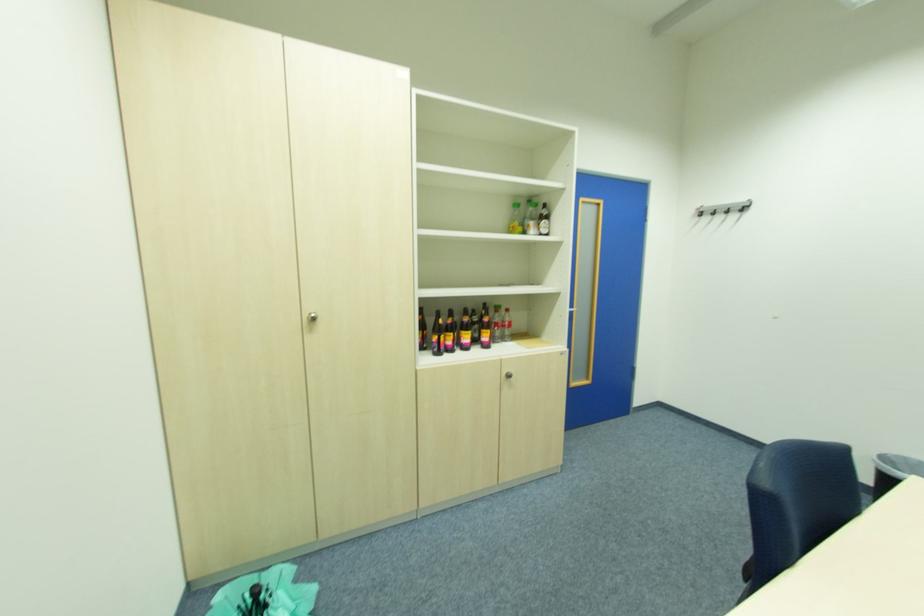
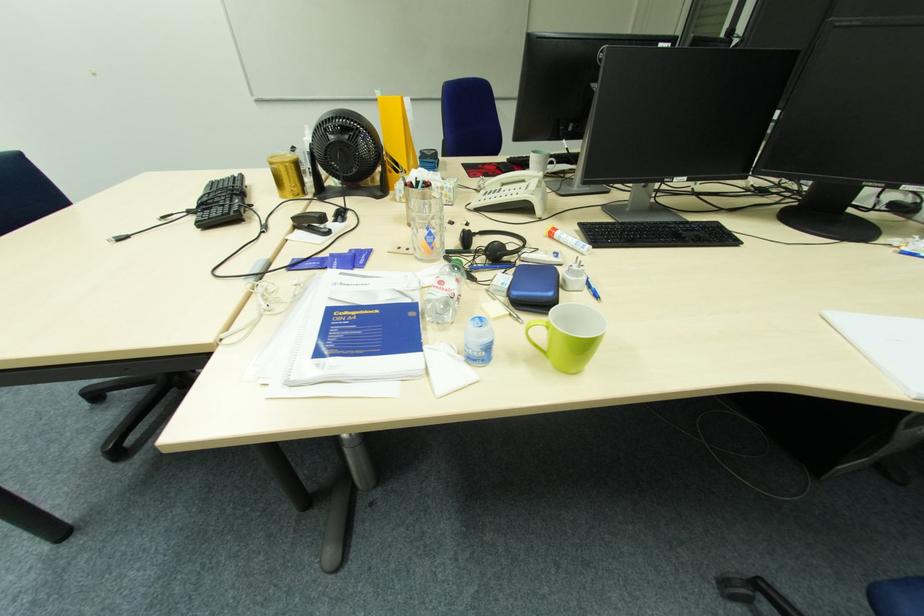
First-person continuous shooting, in which direction is the camera rotating?

The camera rotated toward right-down.